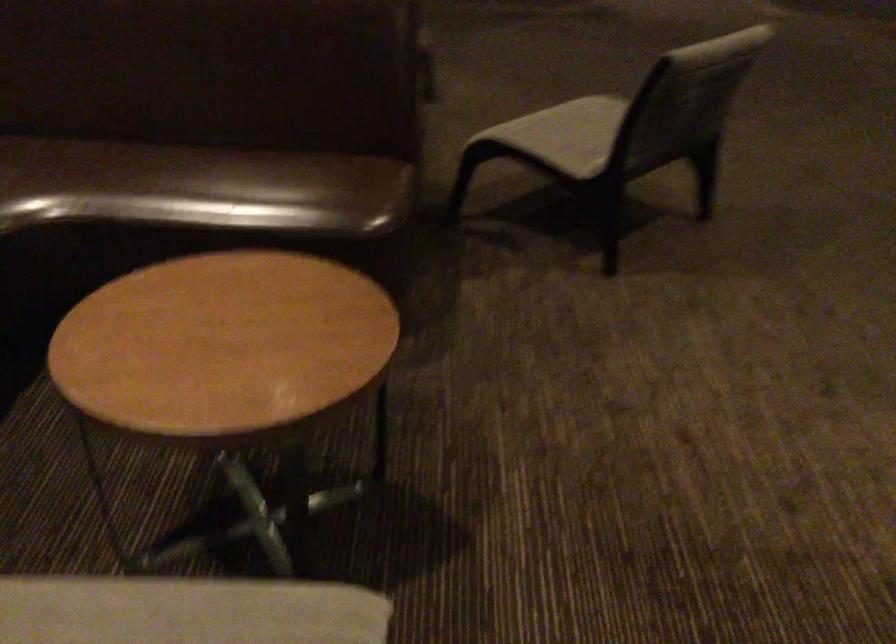
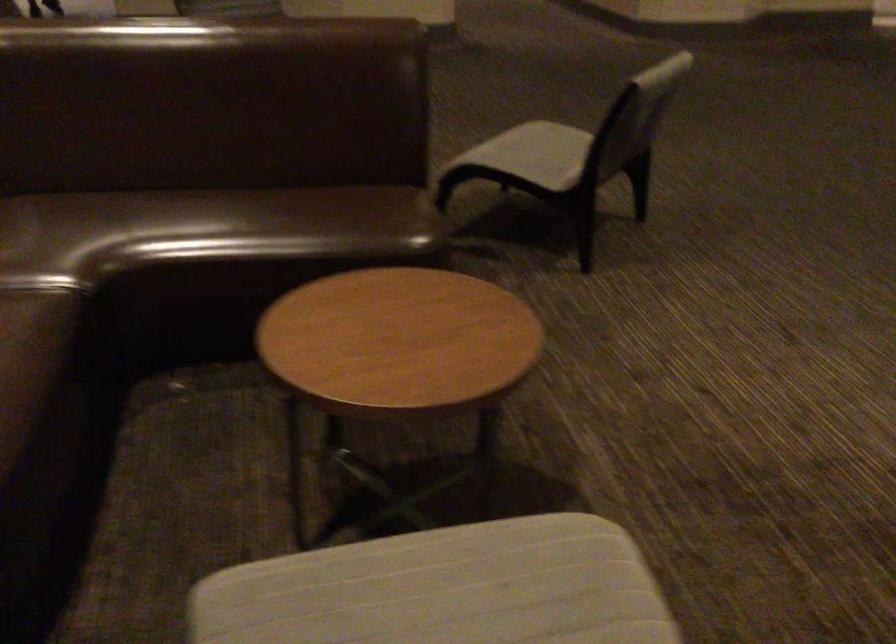
Question: The camera is either moving clockwise (left) or counter-clockwise (right) around the object. The first image is from the beginning of the video and the second image is from the end. Is the camera moving left or right when shooting the video?

Choices:
 (A) Left
 (B) Right

Answer: (A)